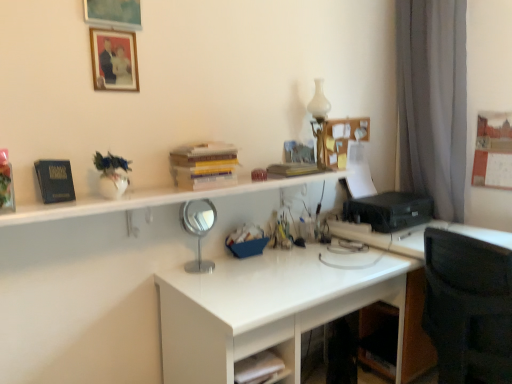
Question: From a real-world perspective, is white glossy desk at center physically above hardcover books at upper center, marked as the second book in a back-to-front arrangement?

Choices:
 (A) no
 (B) yes

Answer: (A)

Question: Considering the relative positions of white glossy desk at center and hardcover books at upper center, marked as the second book in a back-to-front arrangement, in the image provided, is white glossy desk at center to the left of hardcover books at upper center, marked as the second book in a back-to-front arrangement, from the viewer's perspective?

Choices:
 (A) yes
 (B) no

Answer: (B)

Question: Does white glossy desk at center have a lesser width compared to hardcover books at upper center, marked as the second book in a left-to-right arrangement?

Choices:
 (A) yes
 (B) no

Answer: (B)

Question: Is white glossy desk at center far away from hardcover books at upper center, marked as the second book in a back-to-front arrangement?

Choices:
 (A) yes
 (B) no

Answer: (B)

Question: Can you confirm if white glossy desk at center is taller than hardcover books at upper center, the 2th book when ordered from front to back?

Choices:
 (A) yes
 (B) no

Answer: (A)

Question: Is hardcover books at upper center, marked as the second book in a left-to-right arrangement, located within white glossy desk at center?

Choices:
 (A) yes
 (B) no

Answer: (B)

Question: Would you say white glossy desk at center is part of white matte drawer at lower center's contents?

Choices:
 (A) no
 (B) yes

Answer: (A)

Question: Is white matte drawer at lower center outside white glossy desk at center?

Choices:
 (A) no
 (B) yes

Answer: (A)

Question: Considering the relative sizes of white matte drawer at lower center and white glossy desk at center in the image provided, is white matte drawer at lower center wider than white glossy desk at center?

Choices:
 (A) yes
 (B) no

Answer: (B)

Question: Is white matte drawer at lower center thinner than white glossy desk at center?

Choices:
 (A) no
 (B) yes

Answer: (B)

Question: Considering the relative sizes of white matte drawer at lower center and white glossy desk at center in the image provided, is white matte drawer at lower center bigger than white glossy desk at center?

Choices:
 (A) yes
 (B) no

Answer: (B)

Question: Is white matte drawer at lower center positioned with its back to white glossy desk at center?

Choices:
 (A) no
 (B) yes

Answer: (B)

Question: Can you confirm if hardcover books at upper center, marked as the second book in a left-to-right arrangement, is bigger than white glossy vase at upper right?

Choices:
 (A) yes
 (B) no

Answer: (A)